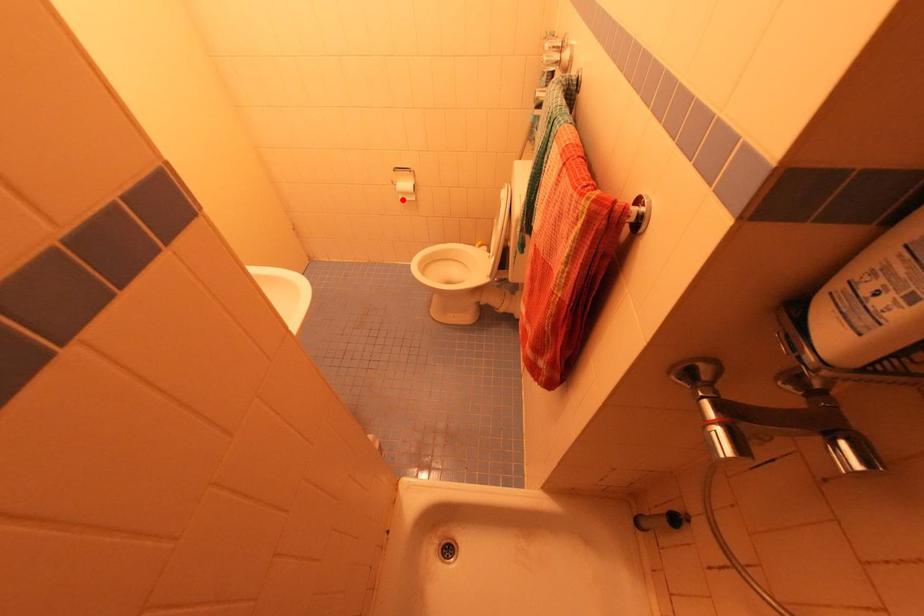
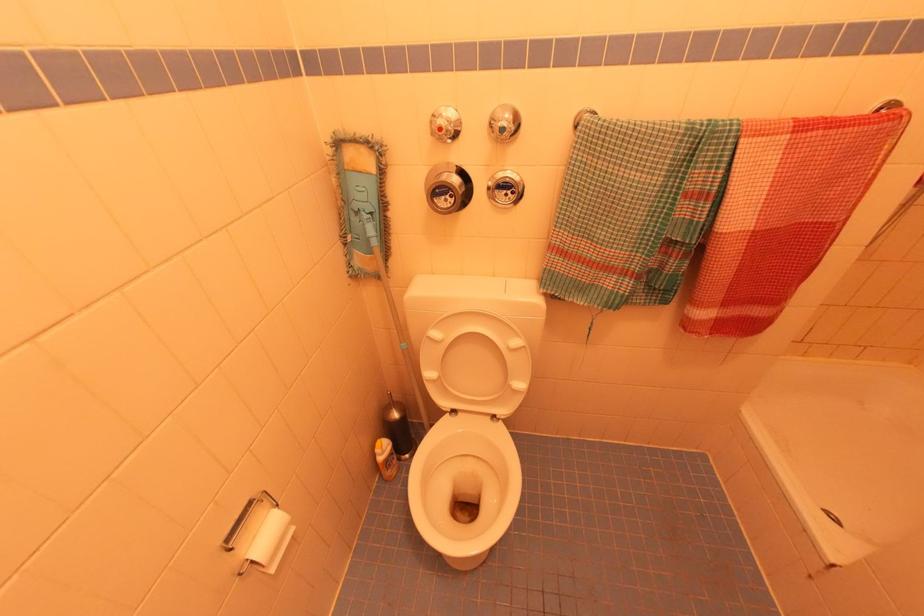
Find the pixel in the second image that matches the highlighted location in the first image.

(274, 570)